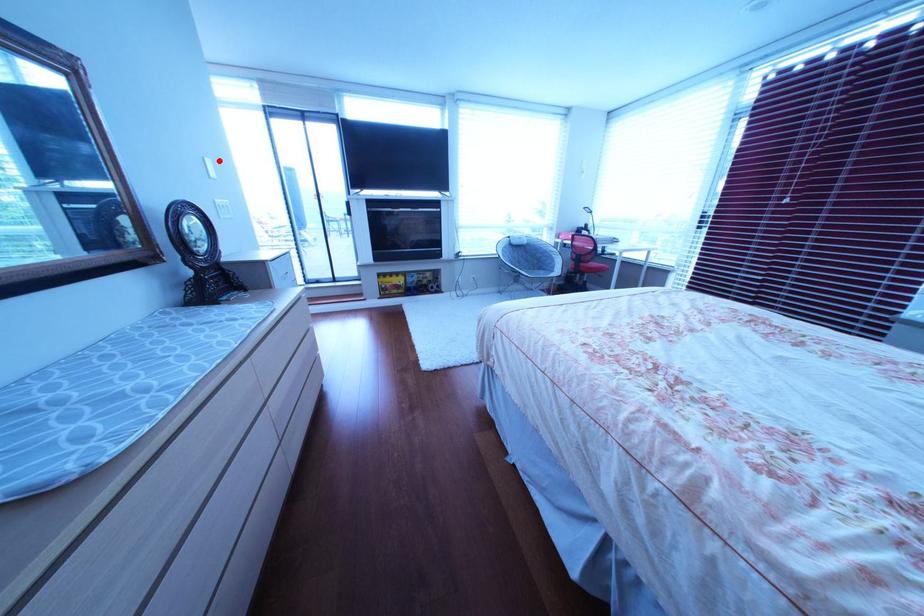
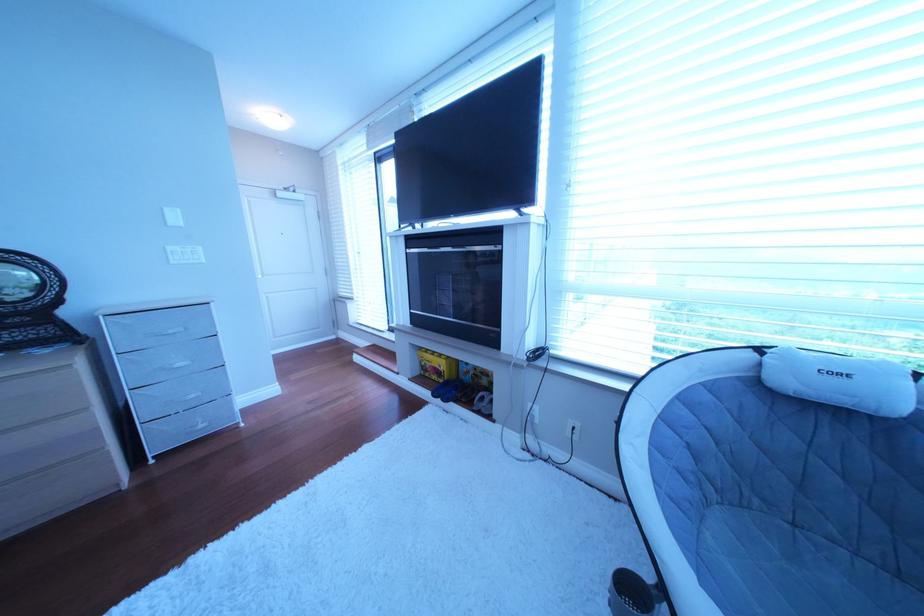
Where in the second image is the point corresponding to the highlighted location from the first image?

(177, 211)